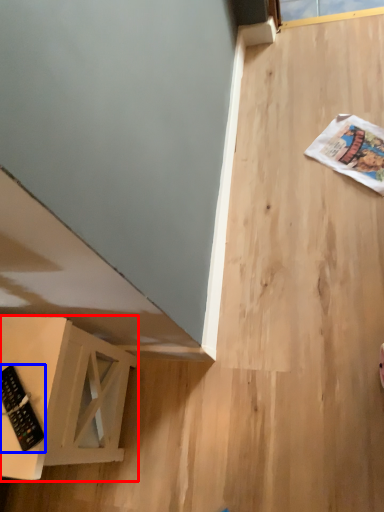
Question: Which of the following is the closest to the observer, furniture (highlighted by a red box) or control (highlighted by a blue box)?

Choices:
 (A) furniture
 (B) control

Answer: (A)